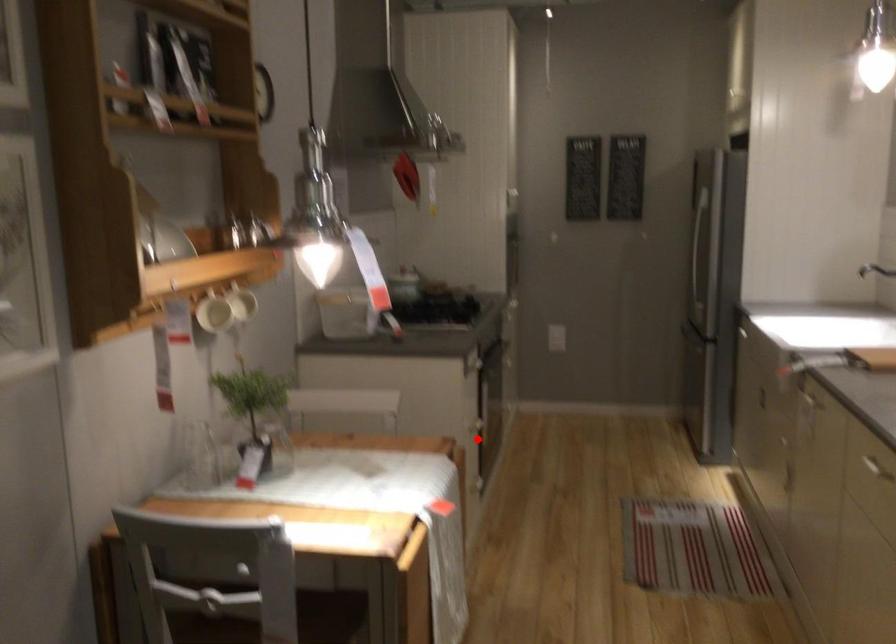
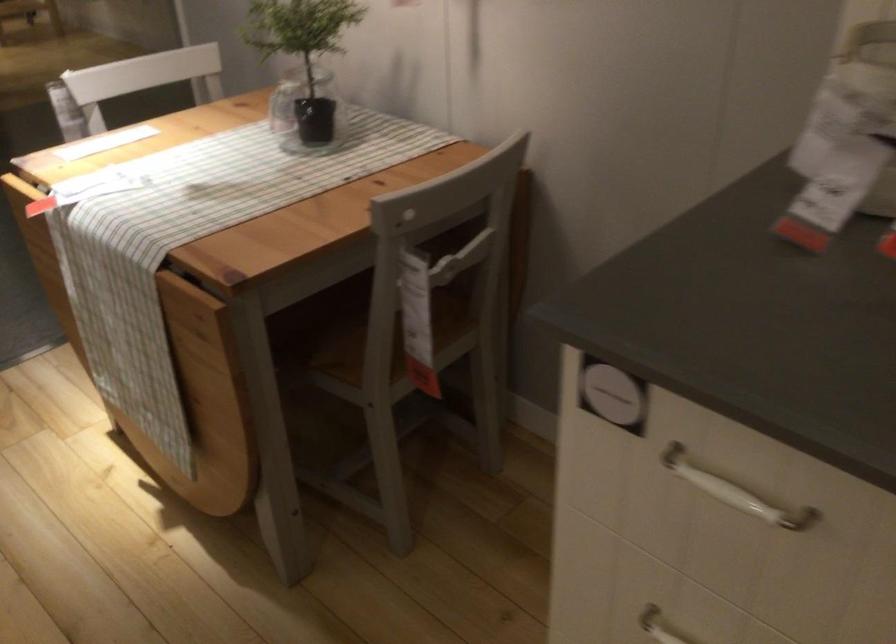
Question: A red point is marked in image1. In image2, is the corresponding 3D point closer to the camera or farther? Reply with the corresponding letter.

Choices:
 (A) The corresponding 3D point is closer.
 (B) The corresponding 3D point is farther.

Answer: (A)